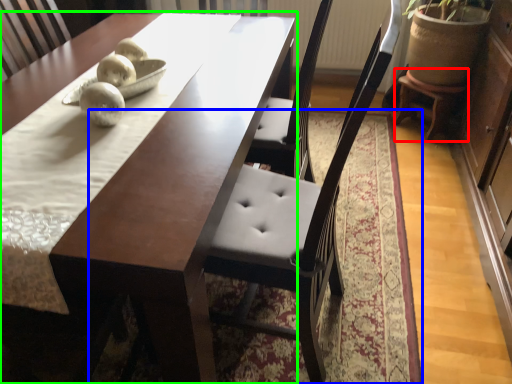
Question: Based on their relative distances, which object is nearer to stool (highlighted by a red box)? Choose from mat (highlighted by a blue box) and table (highlighted by a green box).

Choices:
 (A) mat
 (B) table

Answer: (A)